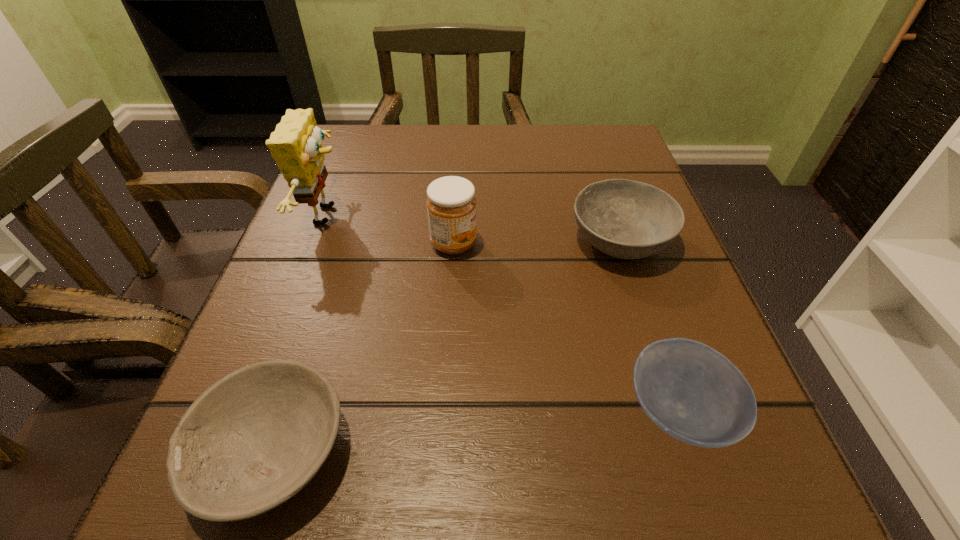
Locate an element on the screen. The image size is (960, 540). sponge is located at coordinates (296, 144).

I want to click on jam, so click(451, 203).

Image resolution: width=960 pixels, height=540 pixels. Find the location of `the third object from right to left`. the third object from right to left is located at coordinates (451, 203).

Where is `the farthest bowl`? This screenshot has width=960, height=540. the farthest bowl is located at coordinates (626, 219).

Where is `the leftmost bowl`? The width and height of the screenshot is (960, 540). the leftmost bowl is located at coordinates (251, 441).

I want to click on free space located 0.390m on the face of the sponge, so click(562, 215).

I want to click on free space located 0.180m on the front label of the jam, so click(582, 244).

Identify the location of vacant area situated 0.210m on the front of the farthest bowl. The image size is (960, 540). (671, 396).

Find the location of a particular element. free space located on the right of the leftmost bowl is located at coordinates (418, 450).

I want to click on object at the far edge, so click(296, 144).